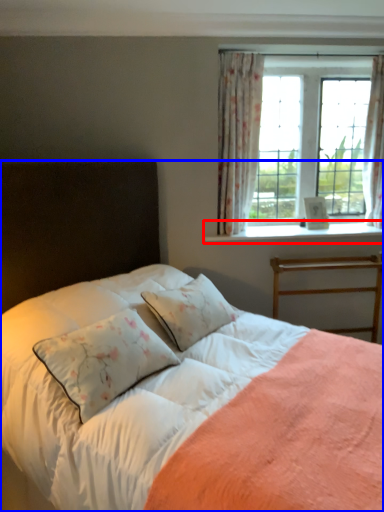
Question: Which point is further to the camera, window sill (highlighted by a red box) or bed (highlighted by a blue box)?

Choices:
 (A) window sill
 (B) bed

Answer: (A)